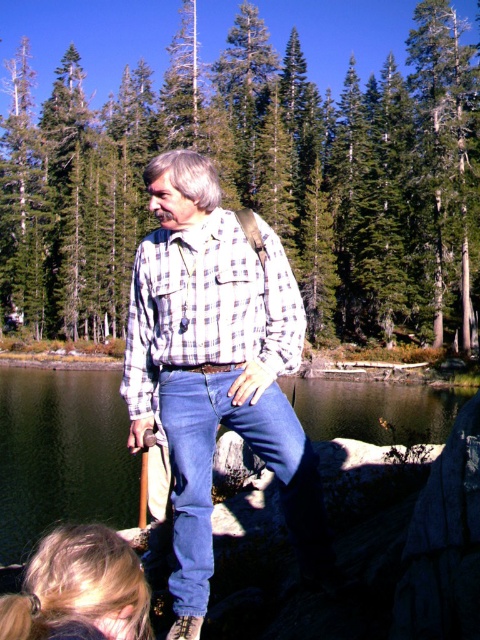
You are a photographer trying to capture the man in the scene. You need to ensure both the white checkered shirt at center and the checkered fabric shirt at center are in focus. What is the minimum distance you should set your camera lens to focus on to include both shirts in sharp focus?

The minimum focusing distance should be set to 35.11 inches to ensure both the white checkered shirt at center and the checkered fabric shirt at center are in focus.

You are a photographer trying to capture the man in the white checkered shirt at center and the clear water at lower center in the same frame. Since the camera can only focus on one subject at a time, which subject should you focus on first if you want to ensure both are in the frame?

The white checkered shirt at center is to the right of clear water at lower center. Focus on the clear water at lower center first, then adjust to include the white checkered shirt at center in the frame.

You are a photographer trying to capture the man in the scene. If you want to focus on the white checkered shirt at center, where should you aim your camera? Please provide the coordinates in the format of x,y where x and y are between 0 and 1.

You should aim your camera at the coordinates (216, 365) to focus on the white checkered shirt at center.